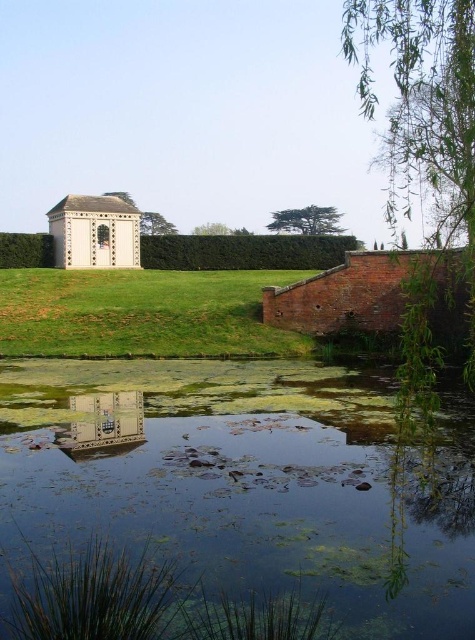
Question: Which of the following is the closest to the observer?

Choices:
 (A) green grassy at center
 (B) clear water at pond center

Answer: (B)

Question: Can you confirm if clear water at pond center is bigger than green grassy at center?

Choices:
 (A) yes
 (B) no

Answer: (B)

Question: Does clear water at pond center appear on the left side of green grassy at center?

Choices:
 (A) yes
 (B) no

Answer: (B)

Question: Is clear water at pond center to the right of green grassy at center from the viewer's perspective?

Choices:
 (A) yes
 (B) no

Answer: (A)